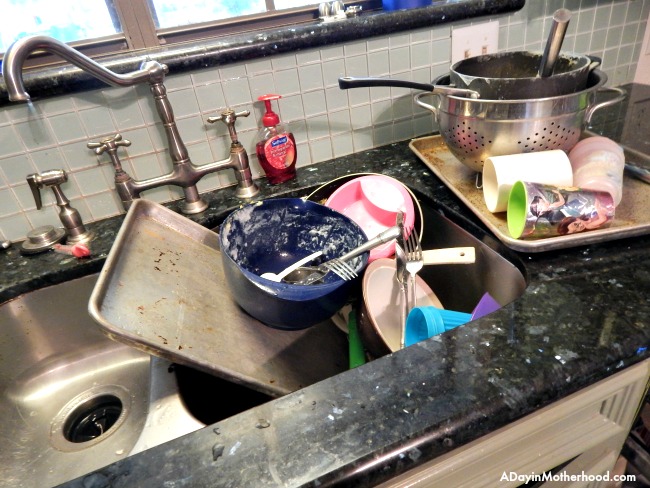
Locate an element on the screen. cups is located at coordinates (507, 158), (528, 182), (587, 164), (426, 330).